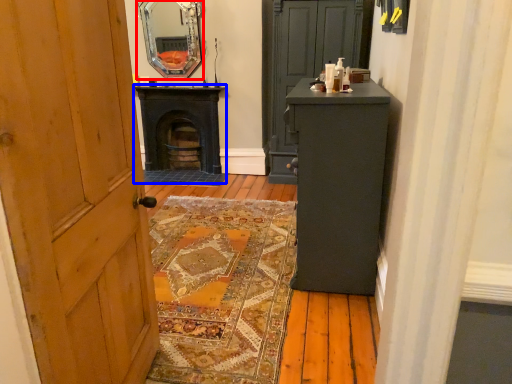
Question: Which object is further to the camera taking this photo, mirror (highlighted by a red box) or stove (highlighted by a blue box)?

Choices:
 (A) mirror
 (B) stove

Answer: (B)